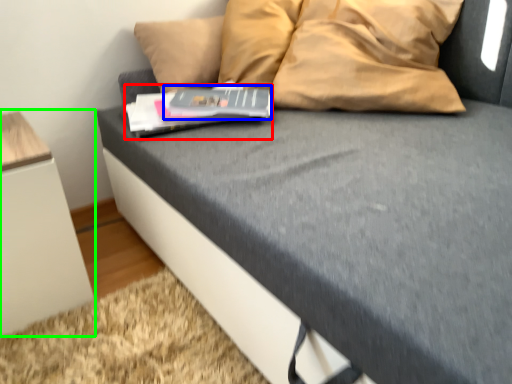
Question: Which is farther away from paperback book (highlighted by a red box)? paperback book (highlighted by a blue box) or furniture (highlighted by a green box)?

Choices:
 (A) paperback book
 (B) furniture

Answer: (B)